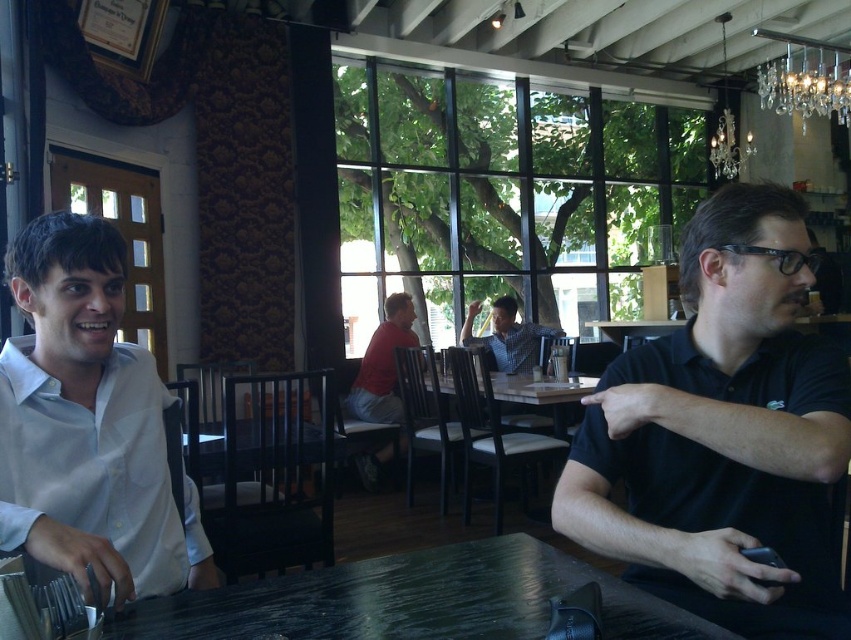
Question: Is white smooth shirt at left closer to the viewer compared to black marble table at center?

Choices:
 (A) yes
 (B) no

Answer: (B)

Question: Which point is closer to the camera?

Choices:
 (A) (566, 413)
 (B) (513, 326)
 (C) (798, 49)
 (D) (530, 579)

Answer: (D)

Question: Which object appears farthest from the camera in this image?

Choices:
 (A) matte red shirt at center
 (B) black matte shirt at right
 (C) black marble table at center
 (D) swarthy crystal chandelier at upper right

Answer: (D)

Question: Does black marble table at center appear on the right side of swarthy crystal chandelier at upper right?

Choices:
 (A) no
 (B) yes

Answer: (A)

Question: Does crystal glass chandelier at upper right appear on the left side of swarthy crystal chandelier at upper right?

Choices:
 (A) yes
 (B) no

Answer: (B)

Question: Which of the following is the closest to the observer?

Choices:
 (A) pos(76,280)
 (B) pos(218,596)
 (C) pos(747,515)
 (D) pos(718,163)

Answer: (B)